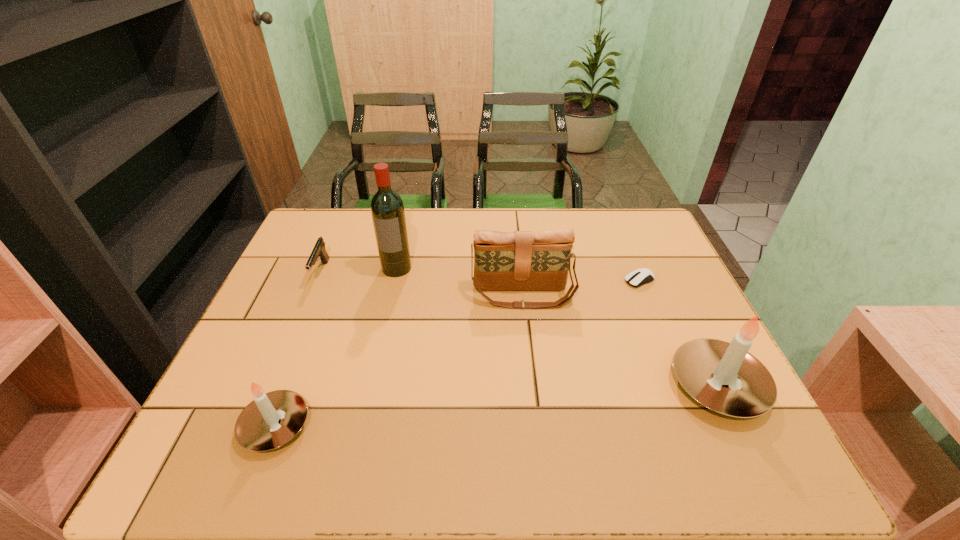
Where is `vacant region located 0.330m on the left of the right candle`? This screenshot has width=960, height=540. vacant region located 0.330m on the left of the right candle is located at coordinates (522, 386).

Image resolution: width=960 pixels, height=540 pixels. In order to click on vacant region located at the muzzle of the fifth tallest object in this screenshot , I will do `click(300, 324)`.

Find the location of a particular element. The width and height of the screenshot is (960, 540). free location located 0.200m on the front-facing side of the shoulder bag is located at coordinates (531, 373).

Where is `vacant space situated on the left of the mouse`? This screenshot has height=540, width=960. vacant space situated on the left of the mouse is located at coordinates click(553, 280).

At what (x,y) coordinates should I click in order to perform the action: click on free region located 0.250m on the label of the wine bottle. Please return your answer as a coordinate pair (x, y). This screenshot has width=960, height=540. Looking at the image, I should click on pyautogui.click(x=379, y=346).

Locate an element on the screen. This screenshot has height=540, width=960. candle that is at the left edge is located at coordinates (272, 419).

Locate an element on the screen. Image resolution: width=960 pixels, height=540 pixels. pistol that is at the left edge is located at coordinates (319, 250).

Locate an element on the screen. The image size is (960, 540). candle that is at the right edge is located at coordinates (702, 366).

Identify the location of mouse situated at the right edge. This screenshot has width=960, height=540. (639, 277).

The image size is (960, 540). I want to click on object situated at the near left corner, so click(x=272, y=419).